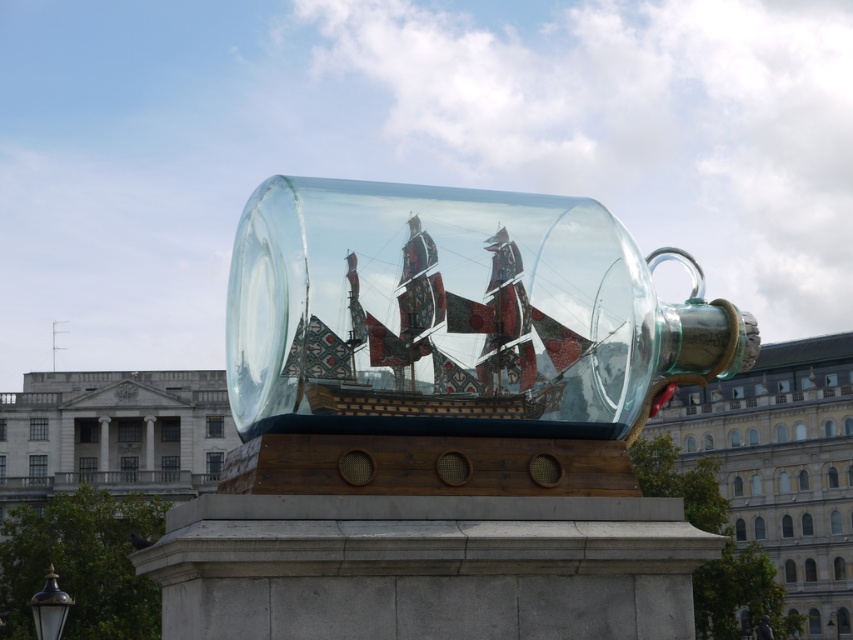
Question: Which point is closer to the camera?

Choices:
 (A) (601, 323)
 (B) (497, 368)

Answer: (B)

Question: Among these objects, which one is farthest from the camera?

Choices:
 (A) transparent glass ship at center
 (B) polished wooden ship at center

Answer: (A)

Question: Does transparent glass ship at center have a lesser width compared to polished wooden ship at center?

Choices:
 (A) yes
 (B) no

Answer: (B)

Question: Is transparent glass ship at center to the left of polished wooden ship at center from the viewer's perspective?

Choices:
 (A) no
 (B) yes

Answer: (A)

Question: Does transparent glass ship at center appear on the right side of polished wooden ship at center?

Choices:
 (A) no
 (B) yes

Answer: (B)

Question: Which of the following is the closest to the observer?

Choices:
 (A) (519, 381)
 (B) (461, 406)

Answer: (B)